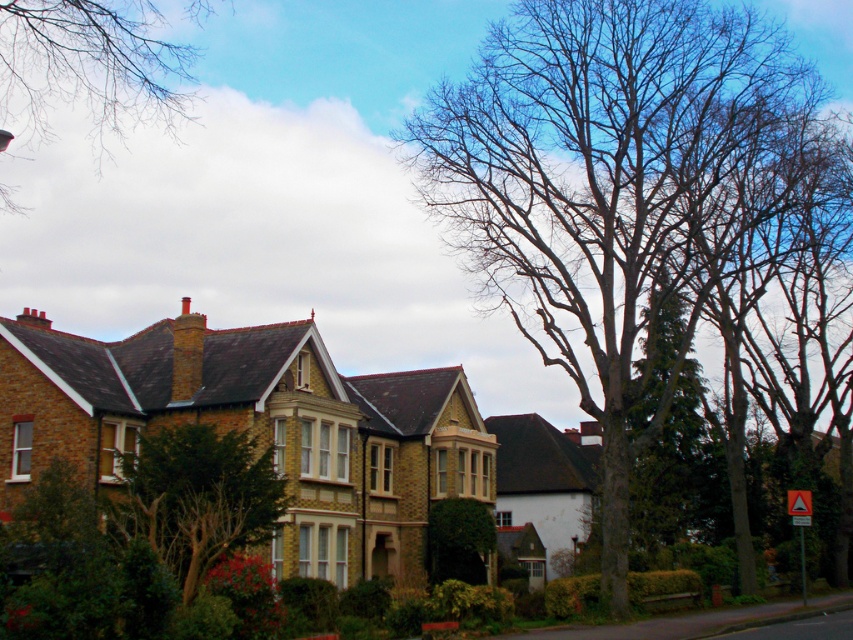
Question: Considering the real-world distances, which object is farthest from the bare wood tree at upper center?

Choices:
 (A) green leafy tree at center
 (B) yellow reflective triangle at lower right
 (C) orange reflective triangle at lower right
 (D) bare branches at upper left

Answer: (B)

Question: Which point is farther to the camera?

Choices:
 (A) (256, 497)
 (B) (805, 492)
 (C) (807, 492)

Answer: (B)

Question: Does bare branches at upper left have a lesser width compared to yellow reflective triangle at lower right?

Choices:
 (A) no
 (B) yes

Answer: (A)

Question: Is bare branches at upper left bigger than yellow reflective triangle at lower right?

Choices:
 (A) yes
 (B) no

Answer: (A)

Question: Which point is farther to the camera?

Choices:
 (A) (184, 83)
 (B) (804, 518)

Answer: (A)

Question: Can you confirm if orange reflective triangle at lower right is positioned above yellow reflective triangle at lower right?

Choices:
 (A) yes
 (B) no

Answer: (B)